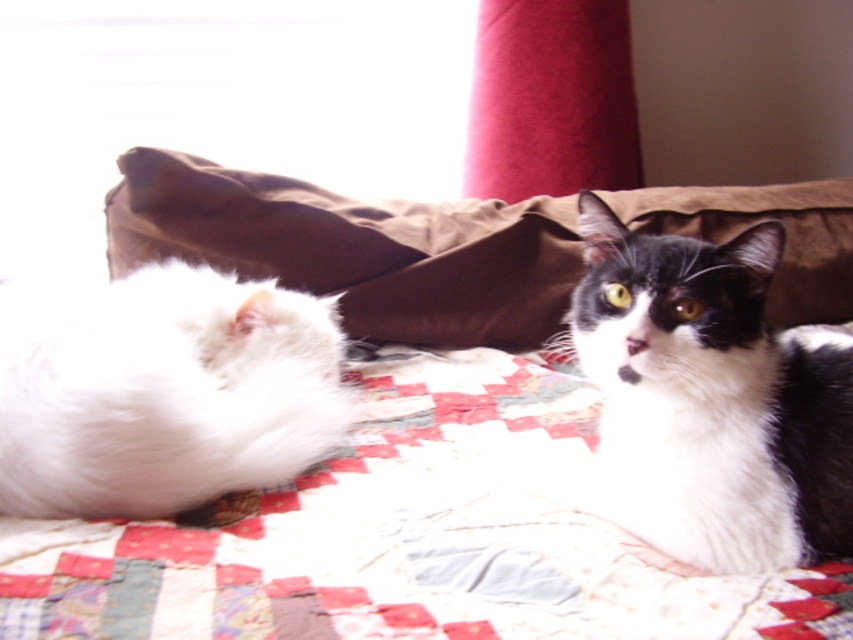
You are a cat owner who wants to place a new toy between the black and white fur cat at upper right and the white fluffy cat at left. Based on their positions, which cat will be closer to the toy once placed in the middle?

The white fluffy cat at left will be closer to the toy because the black and white fur cat at upper right is positioned to the right of it, so the middle point between them would be closer to the left cat.

You are a photographer taking a picture of the black and white fur cat at upper right. The camera focuses on the center point of the image, which is at coordinates 0.5, 0.5. Will the cat be in focus?

The black and white fur cat at upper right is located at coordinates (711, 400), which is outside the center point of the image at (426, 320). Therefore, the cat will not be in focus.

Looking at this image, you are a cat owner who wants to ensure the white fluffy cat at left has enough space to move on the bed. Based on the image, is the brown fabric pillow at center blocking its access to the edge of the bed?

The brown fabric pillow at center is positioned over the white fluffy cat at left, which means the pillow is covering part of the cat, likely limiting its movement and access to the edge of the bed.